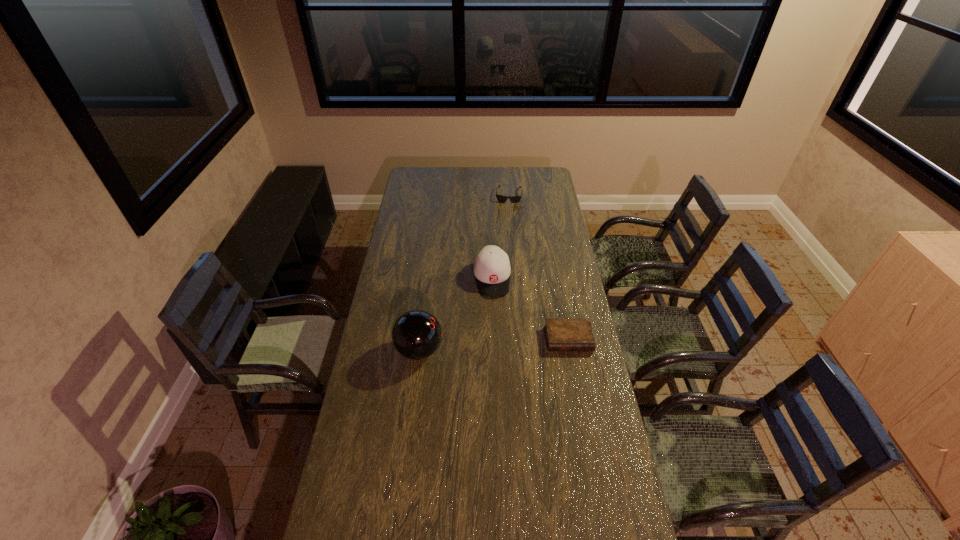
What are the coordinates of `unoccupied area between the farthest object and the bowling ball` in the screenshot? It's located at (464, 273).

Identify which object is the nearest to the second farthest object. Please provide its 2D coordinates. Your answer should be formatted as a tuple, i.e. [(x, y)], where the tuple contains the x and y coordinates of a point satisfying the conditions above.

[(562, 334)]

This screenshot has width=960, height=540. I want to click on object that ranks as the third closest to the tallest object, so click(514, 199).

Where is `vacant space that satisfies the following two spatial constraints: 1. on the back side of the sunglasses; 2. on the left side of the second farthest object`? This screenshot has width=960, height=540. vacant space that satisfies the following two spatial constraints: 1. on the back side of the sunglasses; 2. on the left side of the second farthest object is located at coordinates (490, 195).